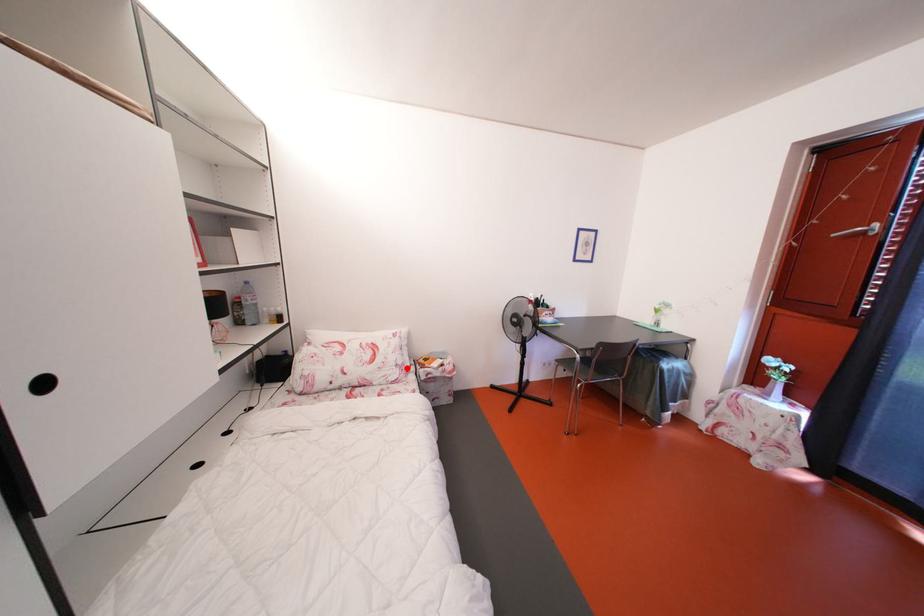
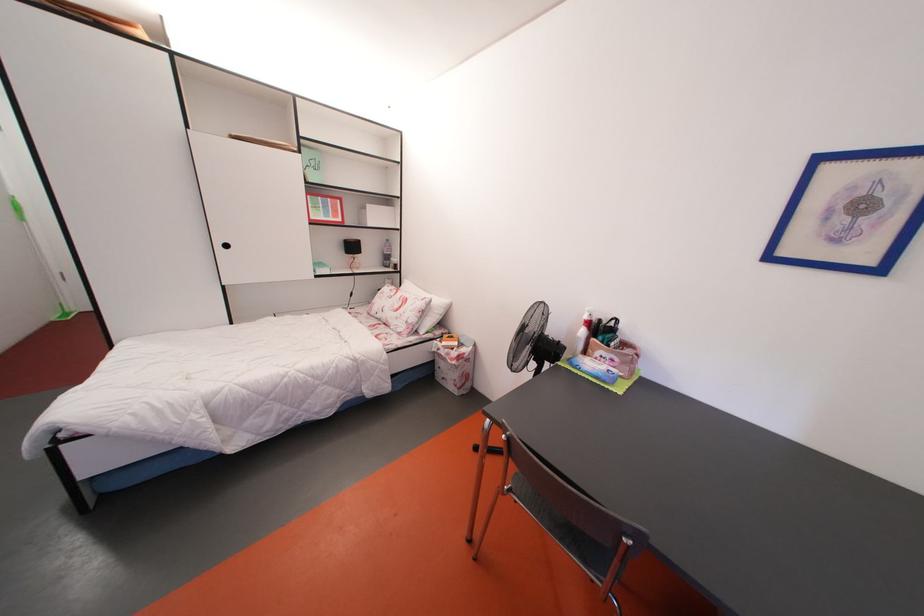
The point at the highlighted location is marked in the first image. Where is the corresponding point in the second image?

(417, 326)